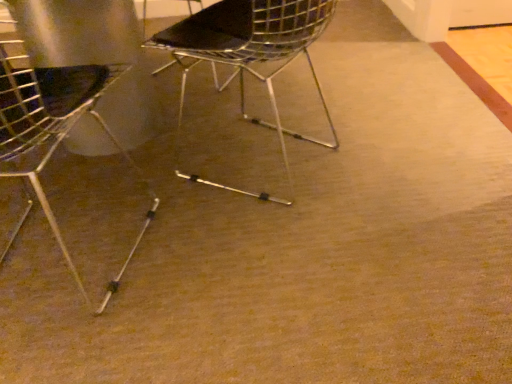
Question: In terms of size, does metallic wire chair at left, the second chair positioned from the right, appear bigger or smaller than metallic wire chair at center, the 1th chair from the right?

Choices:
 (A) small
 (B) big

Answer: (B)

Question: Is point (141, 178) positioned closer to the camera than point (197, 13)?

Choices:
 (A) closer
 (B) farther

Answer: (B)

Question: In the image, is metallic wire chair at left, the second chair positioned from the right, on the left side or the right side of metallic wire chair at center, which is the second chair in left-to-right order?

Choices:
 (A) left
 (B) right

Answer: (A)

Question: In the image, is metallic wire chair at center, the 1th chair from the right, positioned in front of or behind metallic wire chair at left, the first chair when ordered from left to right?

Choices:
 (A) behind
 (B) front

Answer: (A)

Question: Looking at the image, does metallic wire chair at center, which is the second chair in left-to-right order, seem bigger or smaller compared to metallic wire chair at left, the second chair positioned from the right?

Choices:
 (A) small
 (B) big

Answer: (A)

Question: Considering the relative positions of metallic wire chair at center, which is the second chair in left-to-right order, and metallic wire chair at left, the first chair when ordered from left to right, in the image provided, is metallic wire chair at center, which is the second chair in left-to-right order, to the left or to the right of metallic wire chair at left, the first chair when ordered from left to right,?

Choices:
 (A) left
 (B) right

Answer: (B)

Question: From a real-world perspective, is metallic wire chair at center, which is the second chair in left-to-right order, above or below metallic wire chair at left, the second chair positioned from the right?

Choices:
 (A) above
 (B) below

Answer: (B)